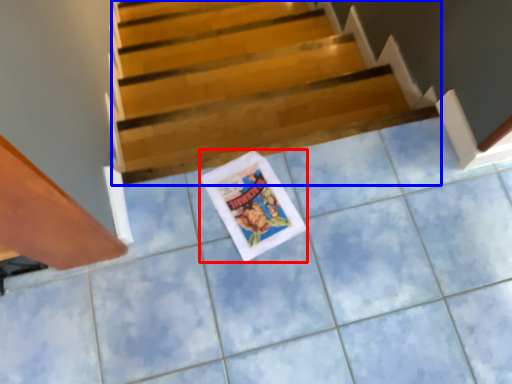
Question: Among these objects, which one is nearest to the camera, comic book (highlighted by a red box) or stairs (highlighted by a blue box)?

Choices:
 (A) comic book
 (B) stairs

Answer: (A)